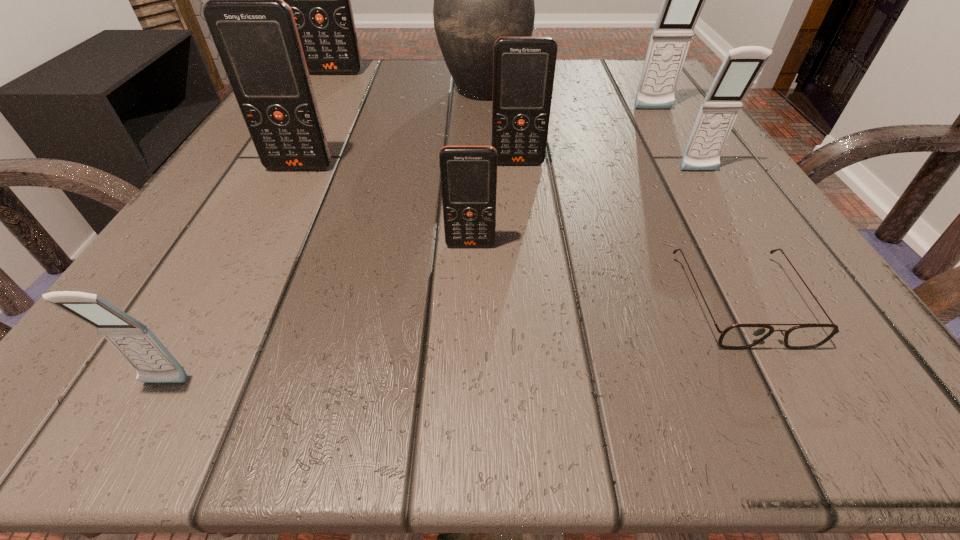
Find the location of a particular element. vacant area that lies between the third smallest orange cellular telephone and the seventh farthest object is located at coordinates (385, 206).

At what (x,y) coordinates should I click in order to perform the action: click on free space between the smallest orange cellular telephone and the sixth nearest cellular telephone. Please return your answer as a coordinate pair (x, y). Looking at the image, I should click on (562, 178).

The image size is (960, 540). In order to click on free space between the nearest gray cellular telephone and the farthest cellular telephone in this screenshot , I will do `click(250, 228)`.

The width and height of the screenshot is (960, 540). I want to click on vacant space in between the second nearest object and the second nearest cellular telephone, so pyautogui.click(x=606, y=273).

I want to click on unoccupied position between the nearest object and the third biggest orange cellular telephone, so click(x=341, y=273).

Select which object appears as the closest to the second nearest object. Please provide its 2D coordinates. Your answer should be formatted as a tuple, i.e. [(x, y)], where the tuple contains the x and y coordinates of a point satisfying the conditions above.

[(742, 65)]

Image resolution: width=960 pixels, height=540 pixels. Find the location of `object that is the second closest to the second farthest gray cellular telephone`. object that is the second closest to the second farthest gray cellular telephone is located at coordinates (738, 336).

Identify which cellular telephone is the closest to the third biggest orange cellular telephone. Please provide its 2D coordinates. Your answer should be formatted as a tuple, i.e. [(x, y)], where the tuple contains the x and y coordinates of a point satisfying the conditions above.

[(468, 174)]

Locate which cellular telephone is the sixth closest to the nearest cellular telephone. Please provide its 2D coordinates. Your answer should be formatted as a tuple, i.e. [(x, y)], where the tuple contains the x and y coordinates of a point satisfying the conditions above.

[(683, 0)]

Locate an element on the screen. The image size is (960, 540). the fourth closest orange cellular telephone to the pitcher is located at coordinates (468, 174).